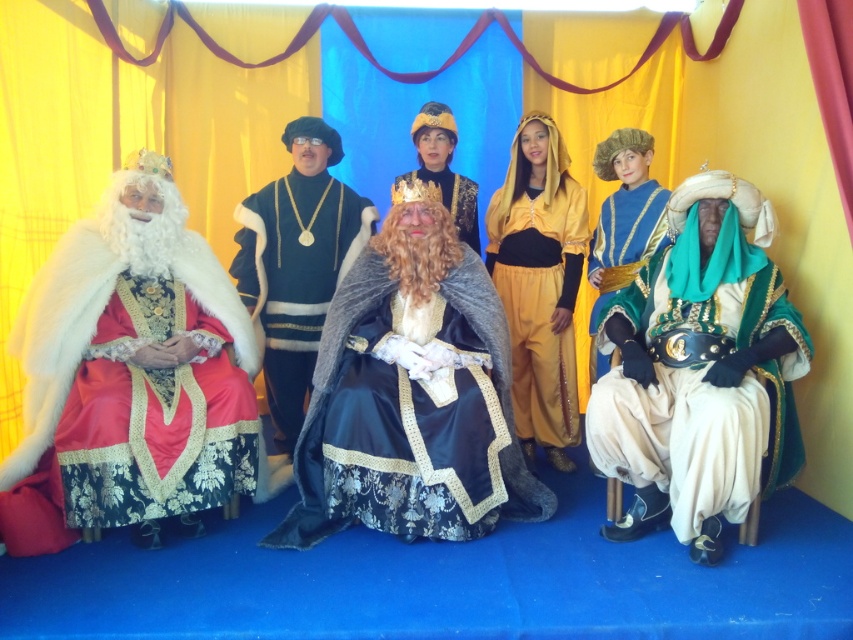
Question: Among these objects, which one is farthest from the camera?

Choices:
 (A) velvet gold crown at center
 (B) velvet green turban at right
 (C) velvet red gown at left

Answer: (A)

Question: Can you confirm if velvet green turban at right is positioned below velvet black dress at center?

Choices:
 (A) yes
 (B) no

Answer: (A)

Question: Which point is closer to the camera taking this photo?

Choices:
 (A) (596, 348)
 (B) (434, 140)
 (C) (310, 250)

Answer: (A)

Question: Is velvet red gown at left to the right of velvet black dress at center from the viewer's perspective?

Choices:
 (A) no
 (B) yes

Answer: (A)

Question: Which is nearer to the velvet gold crown at center?

Choices:
 (A) blue velvet robe at center
 (B) velvet red gown at left

Answer: (B)

Question: Is velvet green turban at right further to the viewer compared to golden fabric dress at center?

Choices:
 (A) yes
 (B) no

Answer: (B)